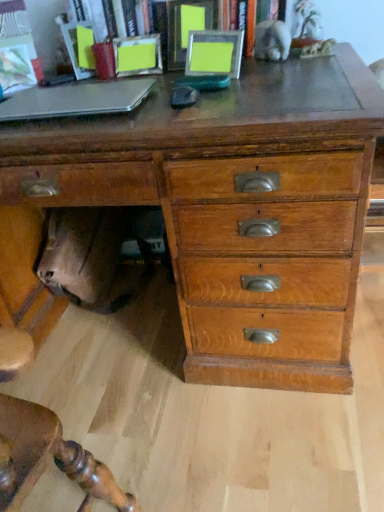
Question: Should I look upward or downward to see wooden chest of drawers at center?

Choices:
 (A) down
 (B) up

Answer: (B)

Question: Is there a large distance between wooden chest of drawers at center and metallic silver photo frames at upper center?

Choices:
 (A) yes
 (B) no

Answer: (B)

Question: Considering the relative sizes of wooden chest of drawers at center and metallic silver photo frames at upper center in the image provided, is wooden chest of drawers at center smaller than metallic silver photo frames at upper center?

Choices:
 (A) no
 (B) yes

Answer: (A)

Question: Is wooden chest of drawers at center facing towards metallic silver photo frames at upper center?

Choices:
 (A) no
 (B) yes

Answer: (A)

Question: From a real-world perspective, is wooden chest of drawers at center below metallic silver photo frames at upper center?

Choices:
 (A) yes
 (B) no

Answer: (A)

Question: From the image's perspective, is wooden chest of drawers at center located beneath metallic silver photo frames at upper center?

Choices:
 (A) yes
 (B) no

Answer: (A)

Question: Is wooden chest of drawers at center facing away from metallic silver photo frames at upper center?

Choices:
 (A) yes
 (B) no

Answer: (B)

Question: From a real-world perspective, is wooden chest of drawers at center positioned over silver metallic laptop at left based on gravity?

Choices:
 (A) no
 (B) yes

Answer: (A)

Question: Is wooden chest of drawers at center positioned with its back to silver metallic laptop at left?

Choices:
 (A) yes
 (B) no

Answer: (B)

Question: Does wooden chest of drawers at center touch silver metallic laptop at left?

Choices:
 (A) no
 (B) yes

Answer: (A)

Question: Does wooden chest of drawers at center turn towards silver metallic laptop at left?

Choices:
 (A) yes
 (B) no

Answer: (B)

Question: Are wooden chest of drawers at center and silver metallic laptop at left far apart?

Choices:
 (A) no
 (B) yes

Answer: (A)

Question: From the image's perspective, does wooden chest of drawers at center appear lower than silver metallic laptop at left?

Choices:
 (A) yes
 (B) no

Answer: (A)

Question: Does metallic silver photo frames at upper center have a larger size compared to silver metallic laptop at left?

Choices:
 (A) yes
 (B) no

Answer: (A)